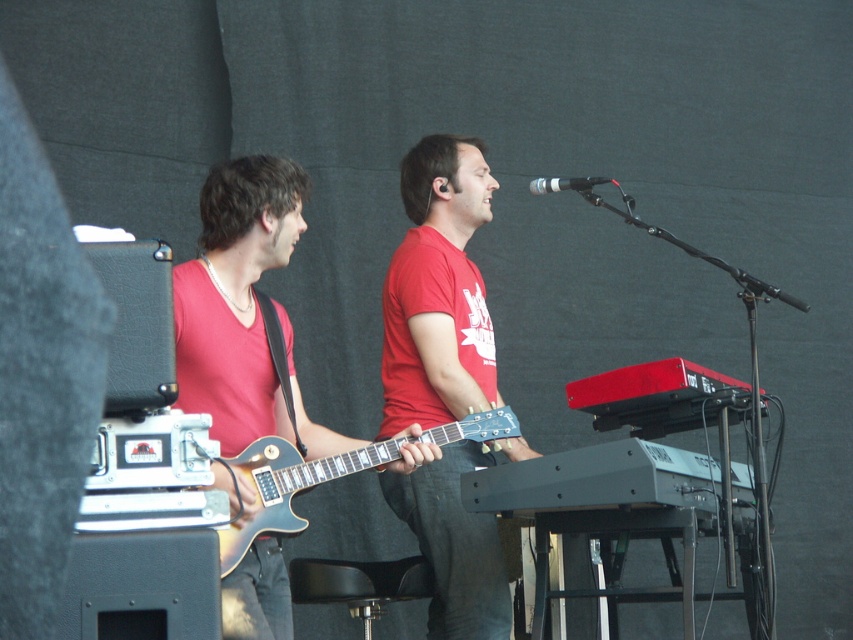
Question: Which point is farther to the camera?

Choices:
 (A) glossy wood guitar at center
 (B) matte red t-shirt at center
 (C) shiny black guitar at left
 (D) black metallic microphone at upper center

Answer: (B)

Question: Is shiny black guitar at left further to the viewer compared to black metallic microphone at upper center?

Choices:
 (A) no
 (B) yes

Answer: (A)

Question: Is shiny black guitar at left smaller than glossy wood guitar at center?

Choices:
 (A) no
 (B) yes

Answer: (A)

Question: Which of these objects is positioned closest to the glossy wood guitar at center?

Choices:
 (A) matte red t-shirt at center
 (B) shiny black guitar at left
 (C) black metallic microphone at upper center

Answer: (B)

Question: In this image, where is shiny black guitar at left located relative to glossy wood guitar at center?

Choices:
 (A) left
 (B) right

Answer: (A)

Question: Which is nearer to the black metallic microphone at upper center?

Choices:
 (A) matte red t-shirt at center
 (B) shiny black guitar at left
 (C) glossy wood guitar at center

Answer: (A)